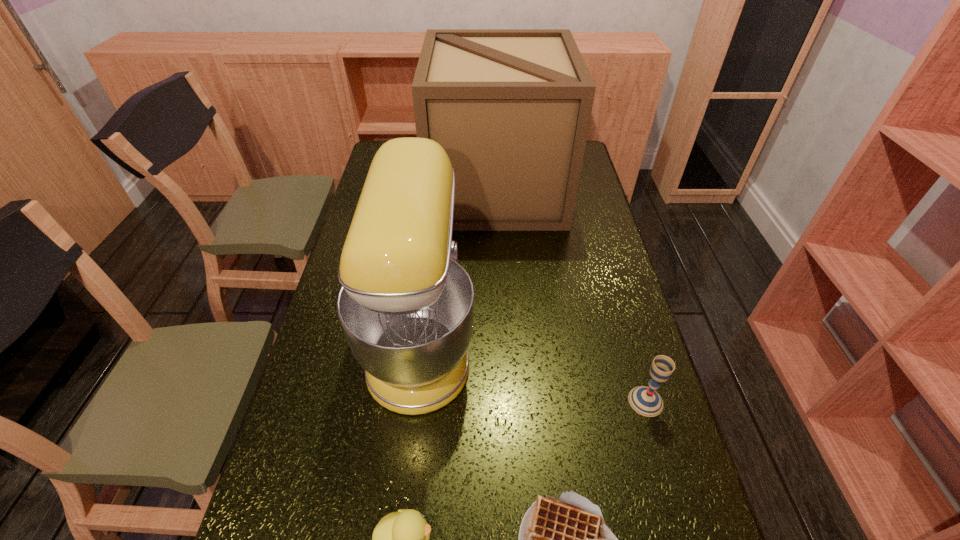
Point out which object is positioned as the third nearest to the box. Please provide its 2D coordinates. Your answer should be formatted as a tuple, i.e. [(x, y)], where the tuple contains the x and y coordinates of a point satisfying the conditions above.

[(566, 539)]

Image resolution: width=960 pixels, height=540 pixels. I want to click on free region that satisfies the following two spatial constraints: 1. on the side of the mixer with the control knob; 2. on the back side of the third shortest object, so click(x=415, y=401).

The image size is (960, 540). Find the location of `vacant area that satisfies the following two spatial constraints: 1. on the side of the rightmost object with the control knob; 2. on the left side of the mixer`. vacant area that satisfies the following two spatial constraints: 1. on the side of the rightmost object with the control knob; 2. on the left side of the mixer is located at coordinates (415, 401).